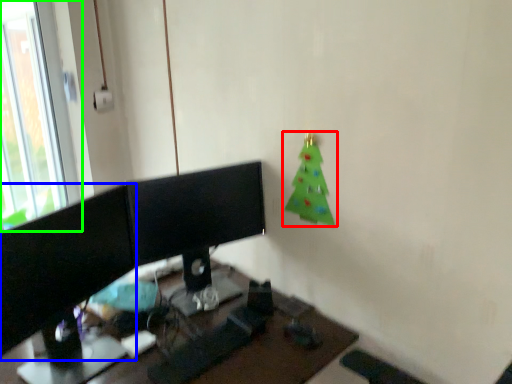
Question: Considering the real-world distances, which object is closest to christmas tree (highlighted by a red box)? computer monitor (highlighted by a blue box) or window (highlighted by a green box).

Choices:
 (A) computer monitor
 (B) window

Answer: (A)